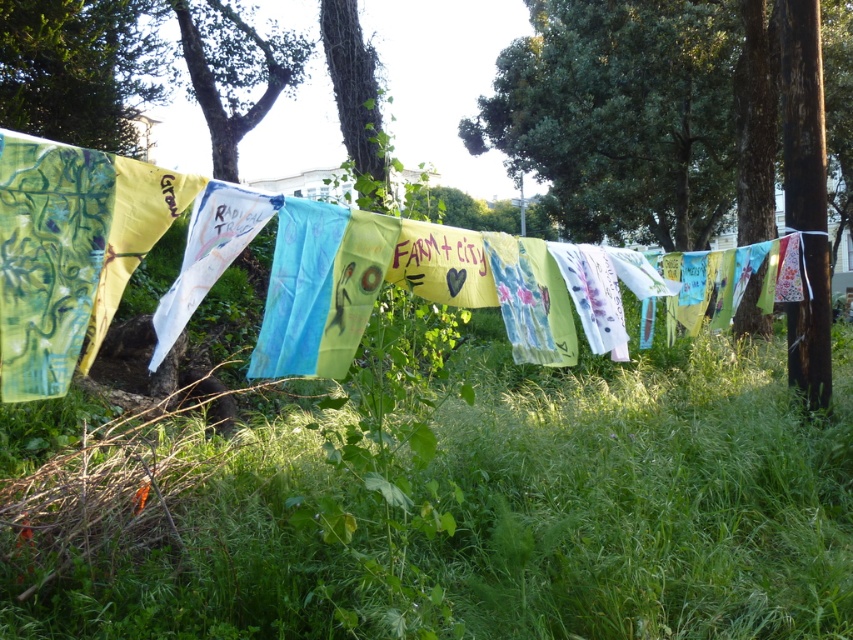
You are a bird looking for a place to perch. You see the green leafy tree at upper left and the green leafy tree at center. Which tree has a wider canopy to land on?

The green leafy tree at upper left has a wider canopy than the green leafy tree at center, so it would provide a wider area to land on.

You are standing in the middle of the grassy area and want to take a photo of both the green leafy tree at upper left and the green leafy tree at center. Which tree should you position closer to the camera to include both in the frame without cropping?

You should position the green leafy tree at upper left closer to the camera because it is taller than the green leafy tree at center, ensuring both fit within the frame without cropping.